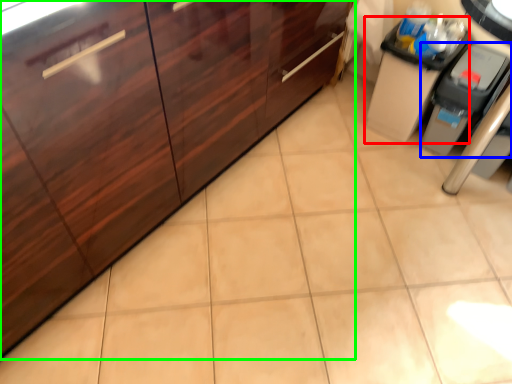
Question: Based on their relative distances, which object is nearer to cabinetry (highlighted by a red box)? Choose from appliance (highlighted by a blue box) and cabinetry (highlighted by a green box).

Choices:
 (A) appliance
 (B) cabinetry

Answer: (A)